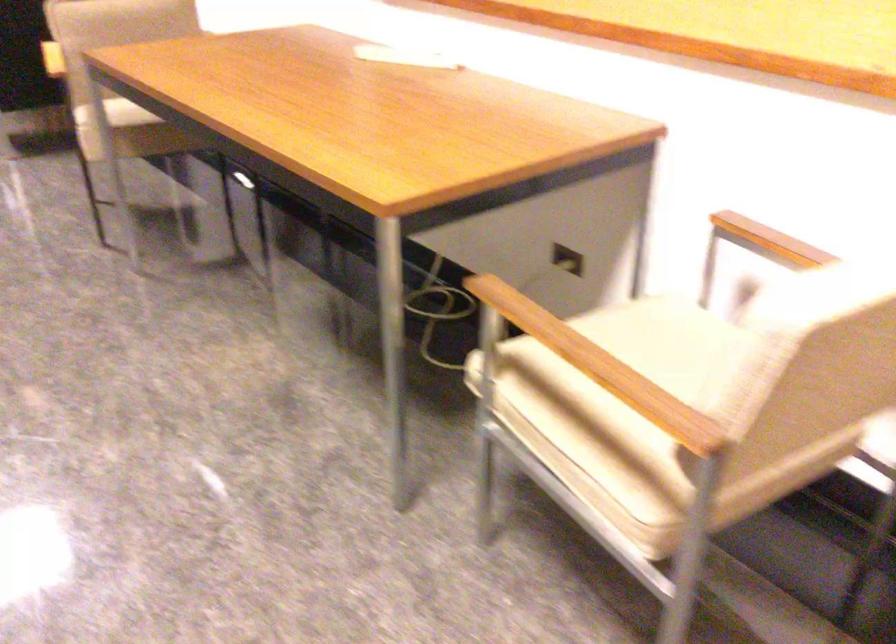
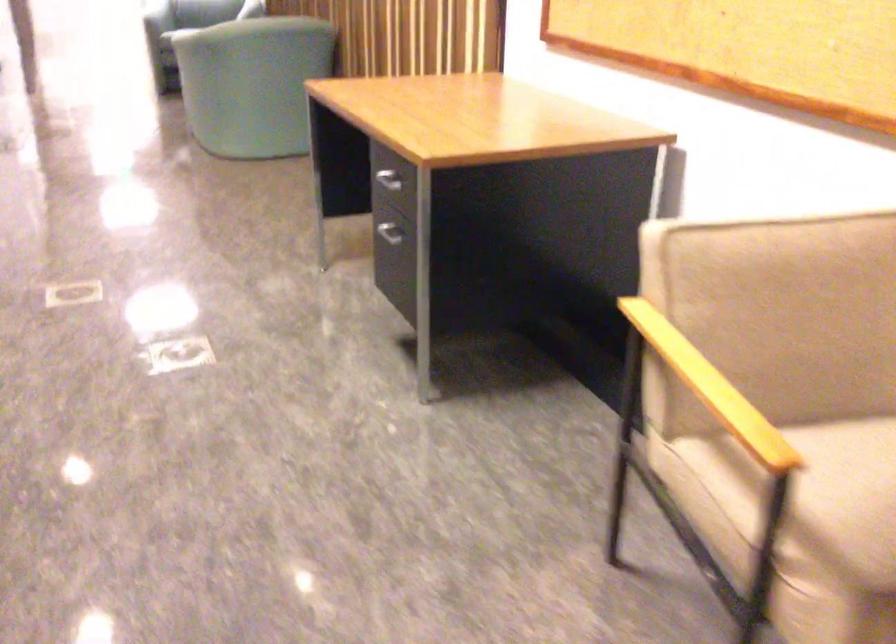
Which direction would the cameraman need to move to produce the second image?

The cameraman moved toward left, forward.